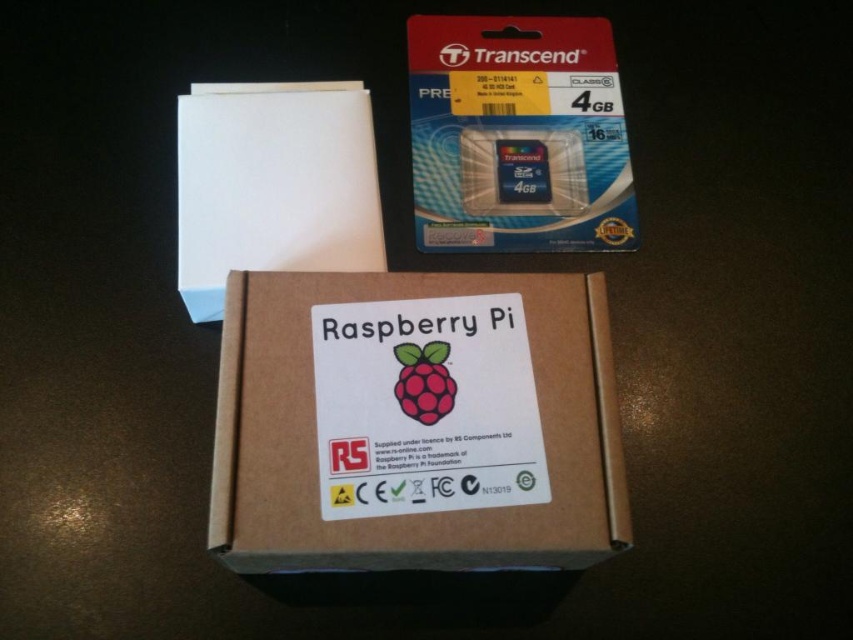
Measure the distance between brown cardboard box at center and white matte paper at upper left.

A distance of 9.58 inches exists between brown cardboard box at center and white matte paper at upper left.

Is brown cardboard box at center taller than white matte paper at upper left?

No.

Find the location of a particular element. brown cardboard box at center is located at coordinates (410, 426).

Where is `brown cardboard box at center`? Image resolution: width=853 pixels, height=640 pixels. brown cardboard box at center is located at coordinates (410, 426).

Which is in front, point (416, 134) or point (428, 417)?

Point (428, 417) is in front.

Is point (445, 99) behind point (426, 413)?

That is True.

Who is more distant from viewer, (x=462, y=20) or (x=444, y=362)?

Positioned behind is point (x=462, y=20).

Find the location of a particular element. translucent plastic sd card at upper right is located at coordinates (517, 134).

Can you confirm if brown cardboard box at center is smaller than translucent plastic sd card at upper right?

Incorrect, brown cardboard box at center is not smaller in size than translucent plastic sd card at upper right.

Image resolution: width=853 pixels, height=640 pixels. Describe the element at coordinates (410, 426) in the screenshot. I see `brown cardboard box at center` at that location.

This screenshot has height=640, width=853. Identify the location of brown cardboard box at center. (410, 426).